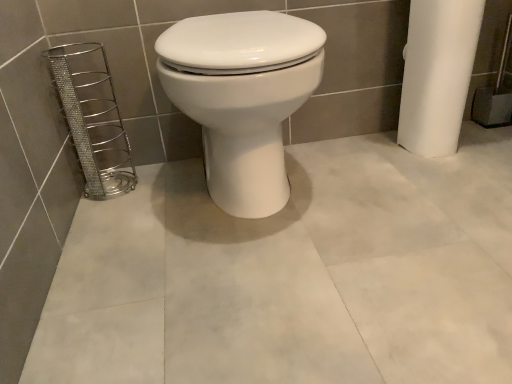
Where is `silver metallic wire basket at left`? silver metallic wire basket at left is located at coordinates (93, 118).

What do you see at coordinates (93, 118) in the screenshot? The height and width of the screenshot is (384, 512). I see `silver metallic wire basket at left` at bounding box center [93, 118].

Identify the location of white glossy toilet at center. This screenshot has width=512, height=384. point(242,97).

Describe the element at coordinates (242, 97) in the screenshot. I see `white glossy toilet at center` at that location.

In order to face white glossy toilet at center, should I rotate leftwards or rightwards?

To face it directly, rotate left by 1.625 degrees.

The image size is (512, 384). Find the location of `silver metallic wire basket at left`. silver metallic wire basket at left is located at coordinates (93, 118).

Is silver metallic wire basket at left at the left side of white glossy toilet at center?

Yes, silver metallic wire basket at left is to the left of white glossy toilet at center.

Is the depth of silver metallic wire basket at left greater than that of white glossy toilet at center?

Yes, silver metallic wire basket at left is behind white glossy toilet at center.

Is point (83, 58) closer to viewer compared to point (226, 82)?

No.

From the image's perspective, is silver metallic wire basket at left located beneath white glossy toilet at center?

Correct, silver metallic wire basket at left appears lower than white glossy toilet at center in the image.

From a real-world perspective, between silver metallic wire basket at left and white glossy toilet at center, who is vertically higher?

white glossy toilet at center is physically above.

Which of these two, silver metallic wire basket at left or white glossy toilet at center, is thinner?

silver metallic wire basket at left.

Is silver metallic wire basket at left taller than white glossy toilet at center?

Incorrect, the height of silver metallic wire basket at left is not larger of that of white glossy toilet at center.

Which of these two, silver metallic wire basket at left or white glossy toilet at center, is smaller?

silver metallic wire basket at left.

Do you think silver metallic wire basket at left is within white glossy toilet at center, or outside of it?

silver metallic wire basket at left lies outside white glossy toilet at center.

Is silver metallic wire basket at left not near white glossy toilet at center?

They are positioned close to each other.

Is silver metallic wire basket at left oriented away from white glossy toilet at center?

No, silver metallic wire basket at left is not facing away from white glossy toilet at center.

How different are the orientations of silver metallic wire basket at left and white glossy toilet at center in degrees?

0.888 degrees.

Locate an element on the screen. porcelain that is under the white glossy toilet at center (from a real-world perspective) is located at coordinates (93, 118).

Between white glossy toilet at center and silver metallic wire basket at left, which one appears on the right side from the viewer's perspective?

white glossy toilet at center.

Who is more distant, white glossy toilet at center or silver metallic wire basket at left?

silver metallic wire basket at left.

Which is behind, point (285, 43) or point (109, 104)?

The point (109, 104) is more distant.

From the image's perspective, which is below, white glossy toilet at center or silver metallic wire basket at left?

silver metallic wire basket at left appears lower in the image.

From a real-world perspective, is white glossy toilet at center above or below silver metallic wire basket at left?

From a real-world perspective, white glossy toilet at center is physically above silver metallic wire basket at left.

Does white glossy toilet at center have a lesser width compared to silver metallic wire basket at left?

No, white glossy toilet at center is not thinner than silver metallic wire basket at left.

Is white glossy toilet at center shorter than silver metallic wire basket at left?

In fact, white glossy toilet at center may be taller than silver metallic wire basket at left.

In terms of size, does white glossy toilet at center appear bigger or smaller than silver metallic wire basket at left?

white glossy toilet at center is bigger than silver metallic wire basket at left.

Is white glossy toilet at center spatially inside silver metallic wire basket at left, or outside of it?

white glossy toilet at center is not inside silver metallic wire basket at left, it's outside.

Are white glossy toilet at center and silver metallic wire basket at left beside each other?

No, white glossy toilet at center is not touching silver metallic wire basket at left.

Is white glossy toilet at center looking in the opposite direction of silver metallic wire basket at left?

No, white glossy toilet at center's orientation is not away from silver metallic wire basket at left.

You are a GUI agent. You are given a task and a screenshot of the screen. Output one action in this format:
    pyautogui.click(x=<x>, y=<y>)
    Task: Click on the porcelain behind the white glossy toilet at center
    The height and width of the screenshot is (384, 512).
    Given the screenshot: What is the action you would take?
    pyautogui.click(x=93, y=118)

Image resolution: width=512 pixels, height=384 pixels. I want to click on toilet above the silver metallic wire basket at left (from a real-world perspective), so click(x=242, y=97).

You are a GUI agent. You are given a task and a screenshot of the screen. Output one action in this format:
    pyautogui.click(x=<x>, y=<y>)
    Task: Click on the porcelain below the white glossy toilet at center (from the image's perspective)
    Image resolution: width=512 pixels, height=384 pixels.
    Given the screenshot: What is the action you would take?
    pyautogui.click(x=93, y=118)